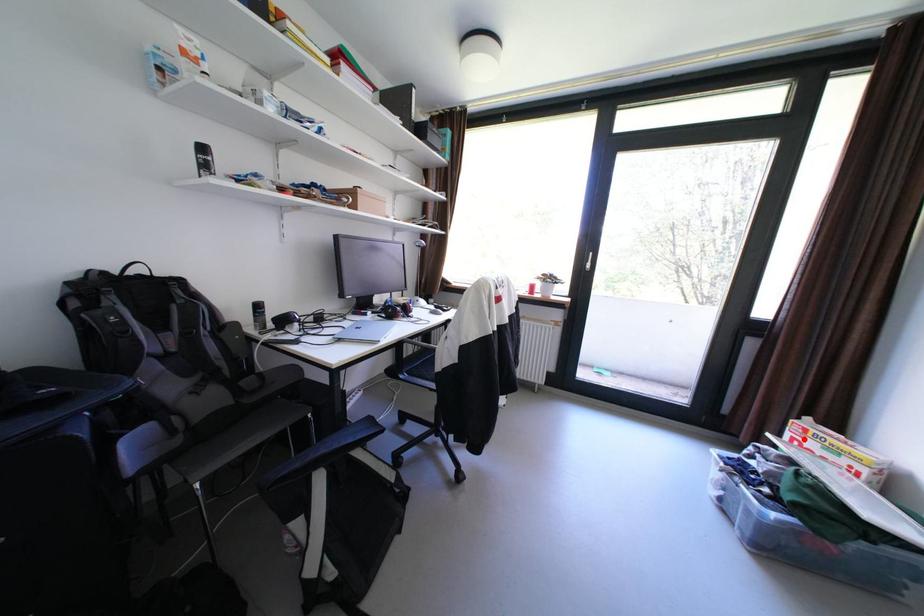
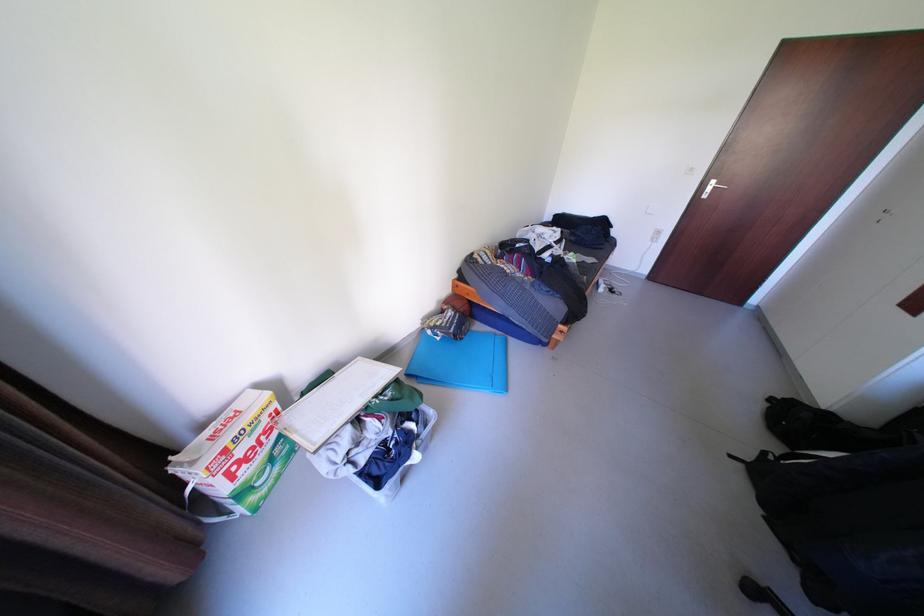
Question: I am providing you with two images of the same scene from different viewpoints. A red point is shown in image1. For the corresponding object point in image2, is it positioned nearer or farther from the camera?

Choices:
 (A) Nearer
 (B) Farther

Answer: (A)